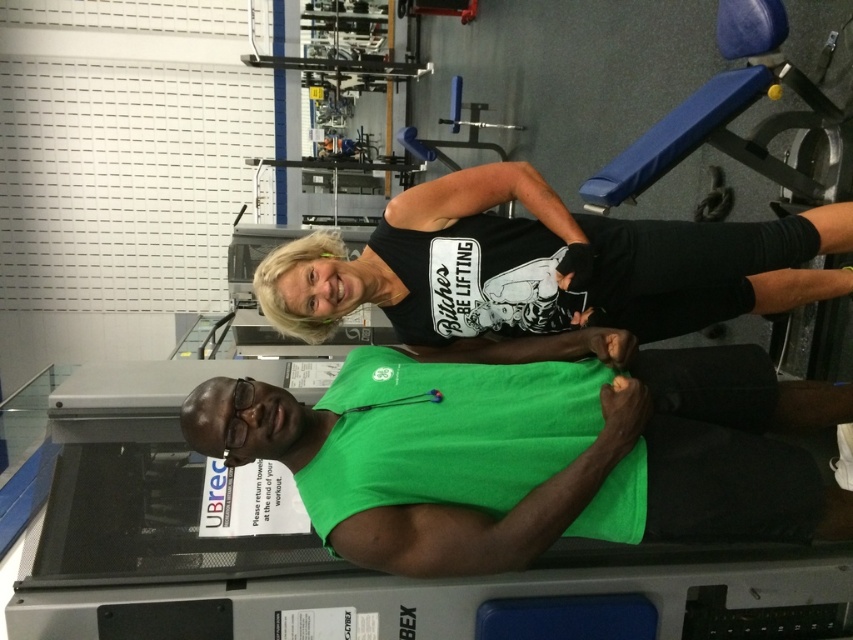
Find the location of a particular element. This screenshot has height=640, width=853. green fabric squat at center is located at coordinates pos(532,456).

Is green fabric squat at center shorter than black matte tank top at upper center?

Indeed, green fabric squat at center has a lesser height compared to black matte tank top at upper center.

Does point (514, 444) come behind point (474, 221)?

No, it is in front of (474, 221).

Locate an element on the screen. green fabric squat at center is located at coordinates (532, 456).